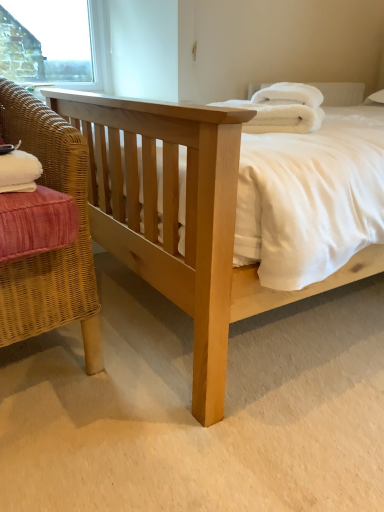
Question: From the image's perspective, is white plastic window frame at upper left located above white fluffy bath towel at upper right?

Choices:
 (A) no
 (B) yes

Answer: (B)

Question: From the image's perspective, does white plastic window frame at upper left appear lower than white fluffy bath towel at upper right?

Choices:
 (A) yes
 (B) no

Answer: (B)

Question: Is white plastic window frame at upper left thinner than white fluffy bath towel at upper right?

Choices:
 (A) no
 (B) yes

Answer: (B)

Question: Can you confirm if white plastic window frame at upper left is wider than white fluffy bath towel at upper right?

Choices:
 (A) yes
 (B) no

Answer: (B)

Question: From a real-world perspective, is white plastic window frame at upper left on top of white fluffy bath towel at upper right?

Choices:
 (A) no
 (B) yes

Answer: (B)

Question: Can you confirm if white plastic window frame at upper left is positioned to the left of white fluffy bath towel at upper right?

Choices:
 (A) yes
 (B) no

Answer: (A)

Question: Can you confirm if woven wicker chair at left is wider than white plastic window frame at upper left?

Choices:
 (A) yes
 (B) no

Answer: (A)

Question: Is woven wicker chair at left bigger than white plastic window frame at upper left?

Choices:
 (A) yes
 (B) no

Answer: (A)

Question: Does woven wicker chair at left come in front of white plastic window frame at upper left?

Choices:
 (A) no
 (B) yes

Answer: (B)

Question: Can you confirm if woven wicker chair at left is thinner than white plastic window frame at upper left?

Choices:
 (A) no
 (B) yes

Answer: (A)

Question: Is there a large distance between woven wicker chair at left and white plastic window frame at upper left?

Choices:
 (A) no
 (B) yes

Answer: (B)

Question: Is white plastic window frame at upper left surrounded by woven wicker chair at left?

Choices:
 (A) yes
 (B) no

Answer: (B)

Question: From the image's perspective, is natural wood bed at center on white plastic window frame at upper left?

Choices:
 (A) no
 (B) yes

Answer: (A)